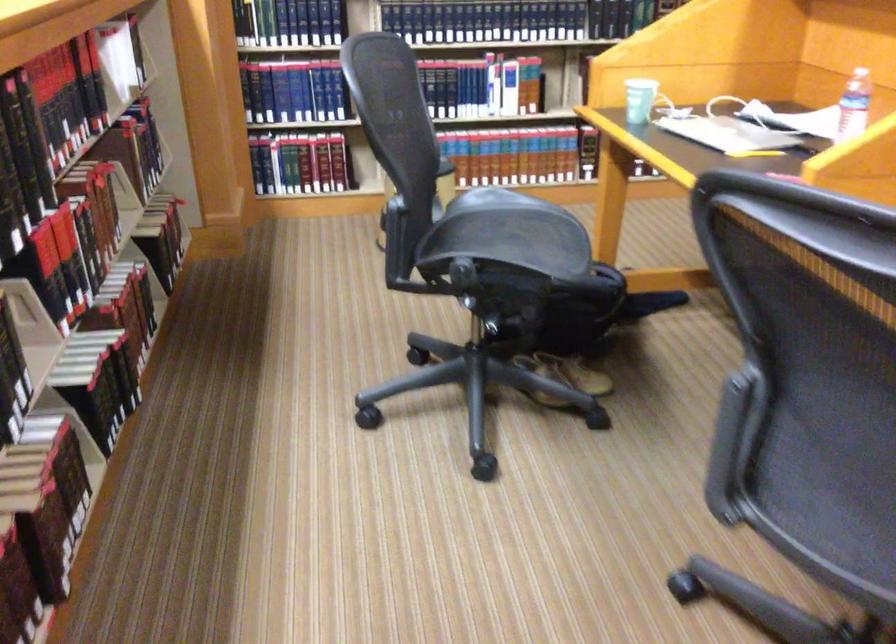
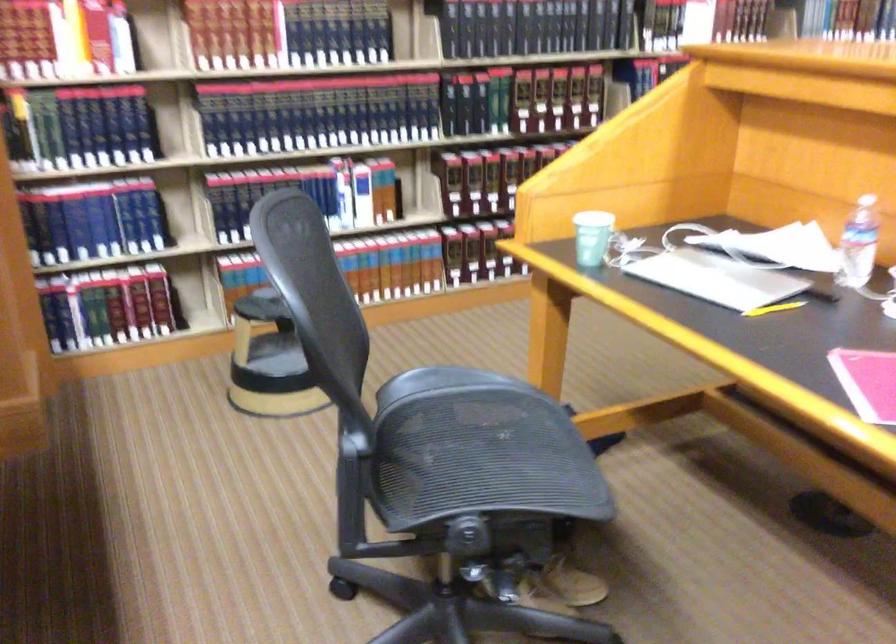
Find the pixel in the second image that matches [760,149] in the first image.

(774, 307)